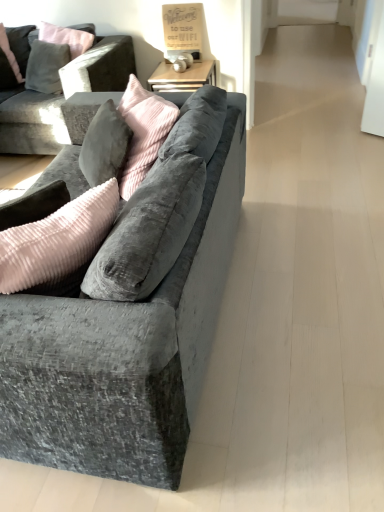
Where is `vacant area located to the right-hand side of velvet grey couch at left, arranged as the first studio couch when viewed from the front`? The width and height of the screenshot is (384, 512). vacant area located to the right-hand side of velvet grey couch at left, arranged as the first studio couch when viewed from the front is located at coordinates (305, 256).